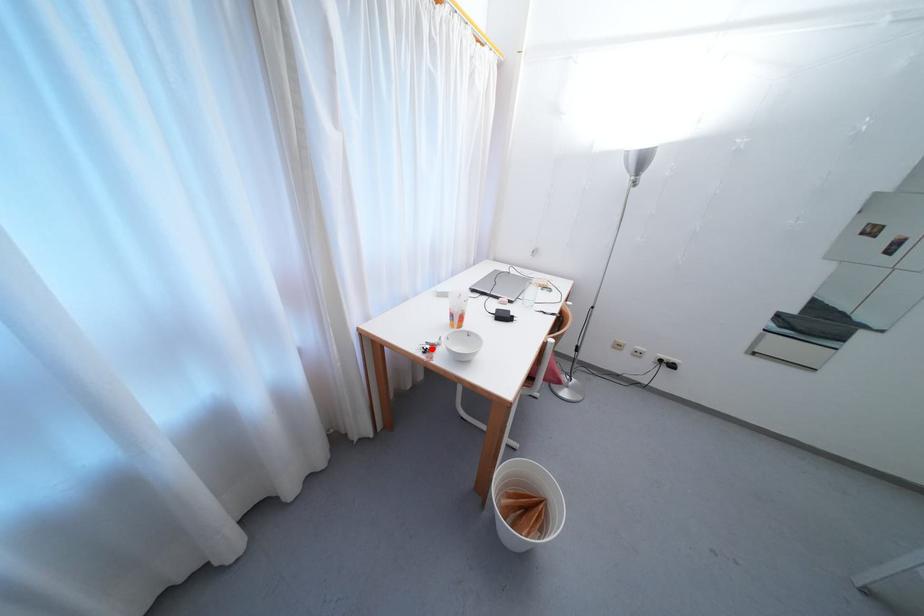
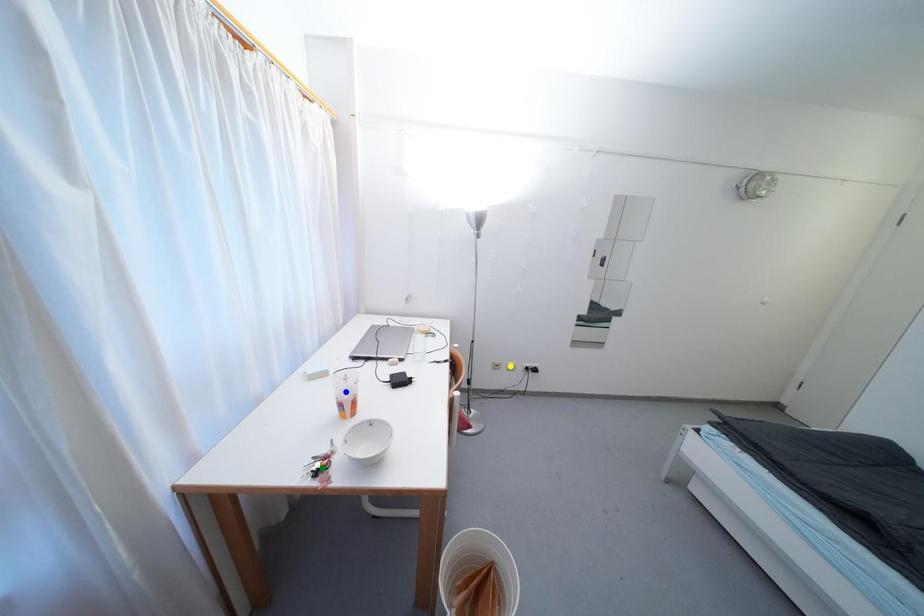
Question: I am providing you with two images of the same scene from different viewpoints. A red point is marked on the first image. You are given multiple points on the second image. Which spot in image 2 lines up with the point in image 1?

Choices:
 (A) blue point
 (B) yellow point
 (C) green point

Answer: (C)